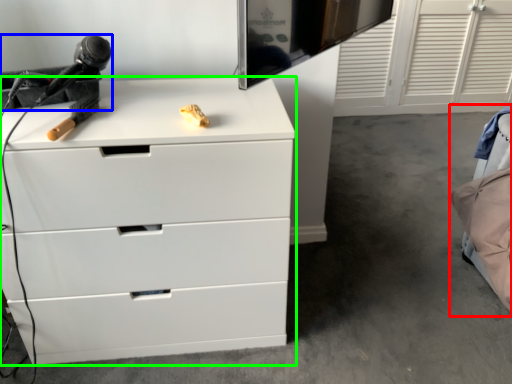
Question: Which object is the farthest from bed (highlighted by a red box)? Choose among these: equipment (highlighted by a blue box) or chest of drawers (highlighted by a green box).

Choices:
 (A) equipment
 (B) chest of drawers

Answer: (A)